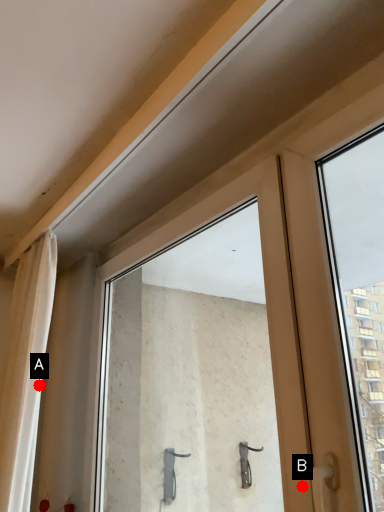
Question: Two points are circled on the image, labeled by A and B beside each circle. Which point appears farthest from the camera in this image?

Choices:
 (A) A is further
 (B) B is further

Answer: (A)